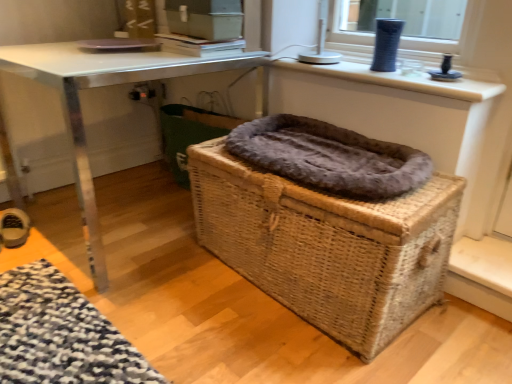
Question: From the image's perspective, is fuzzy brown laundry basket at center positioned above or below fuzzy gray blanket at center?

Choices:
 (A) below
 (B) above

Answer: (B)

Question: Is point (183, 158) positioned closer to the camera than point (402, 157)?

Choices:
 (A) closer
 (B) farther

Answer: (B)

Question: Based on their relative distances, which object is nearer to the matte blue vase at upper right?

Choices:
 (A) fuzzy brown laundry basket at center
 (B) woven brown basket at center
 (C) fuzzy gray blanket at center
 (D) metallic silver table at center
 (E) leather shoe at lower left

Answer: (C)

Question: Which of these objects is positioned closest to the leather shoe at lower left?

Choices:
 (A) fuzzy gray blanket at center
 (B) metallic silver table at center
 (C) fuzzy brown laundry basket at center
 (D) woven brown basket at center
 (E) matte blue vase at upper right

Answer: (B)